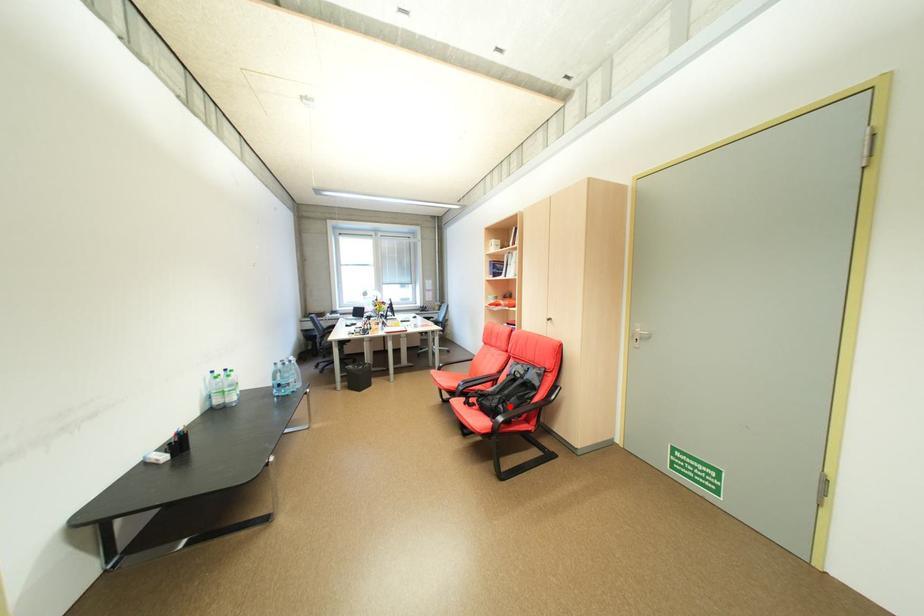
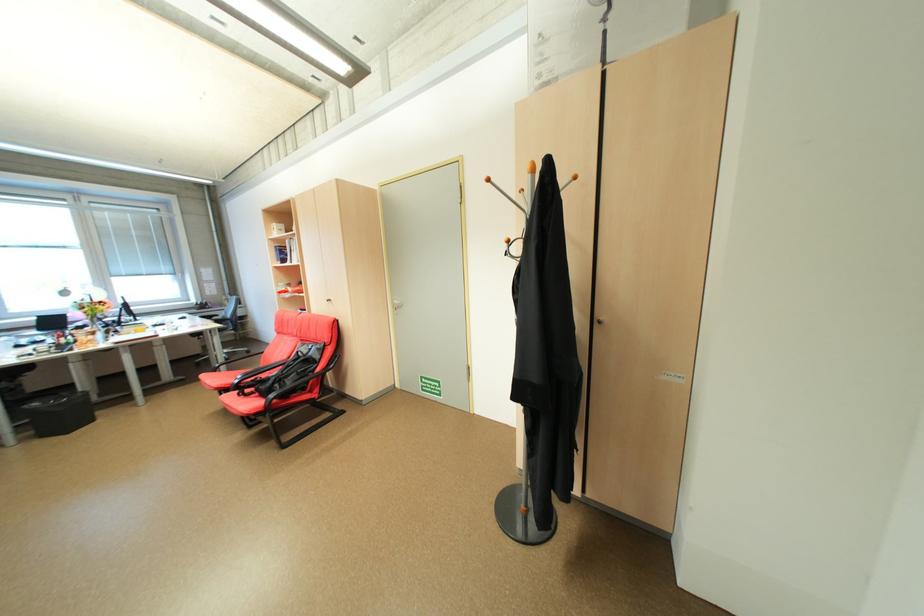
Where in the second image is the point corresponding to the highlighted location from the first image?

(286, 386)